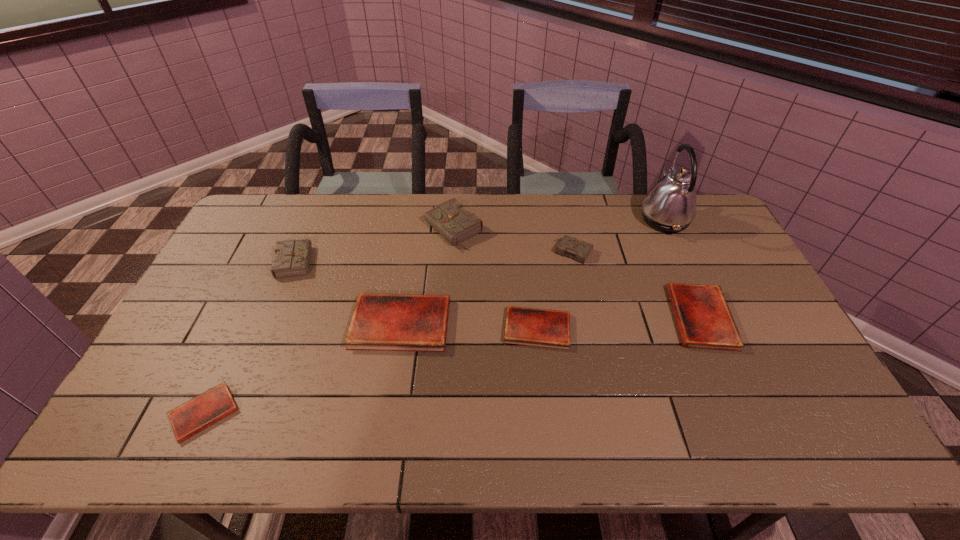
Image resolution: width=960 pixels, height=540 pixels. Find the location of `vacant area located on the back of the smallest green diary`. vacant area located on the back of the smallest green diary is located at coordinates (563, 202).

At what (x,y) coordinates should I click in order to perform the action: click on blank space located 0.260m on the left of the fourth shortest object. Please return your answer as a coordinate pair (x, y). The width and height of the screenshot is (960, 540). Looking at the image, I should click on (262, 323).

This screenshot has height=540, width=960. Find the location of `blank area located on the back of the sixth tallest object`. blank area located on the back of the sixth tallest object is located at coordinates (680, 272).

Locate an element on the screen. vacant space located 0.230m on the back of the second red diary from right to left is located at coordinates (529, 255).

Locate an element on the screen. free space located on the back of the smallest red diary is located at coordinates (265, 282).

The height and width of the screenshot is (540, 960). Find the location of `kettle situated at the far edge`. kettle situated at the far edge is located at coordinates (670, 206).

This screenshot has height=540, width=960. Find the location of `diary positioned at the far edge`. diary positioned at the far edge is located at coordinates (450, 219).

Locate an element on the screen. This screenshot has height=540, width=960. object that is at the near edge is located at coordinates (204, 410).

Where is `object that is positioned at the left edge`? The image size is (960, 540). object that is positioned at the left edge is located at coordinates (204, 410).

You are a GUI agent. You are given a task and a screenshot of the screen. Output one action in this format:
    pyautogui.click(x=<x>, y=<y>)
    Task: Click on the kettle located at the right edge
    The image size is (960, 540).
    Given the screenshot: What is the action you would take?
    pyautogui.click(x=670, y=206)